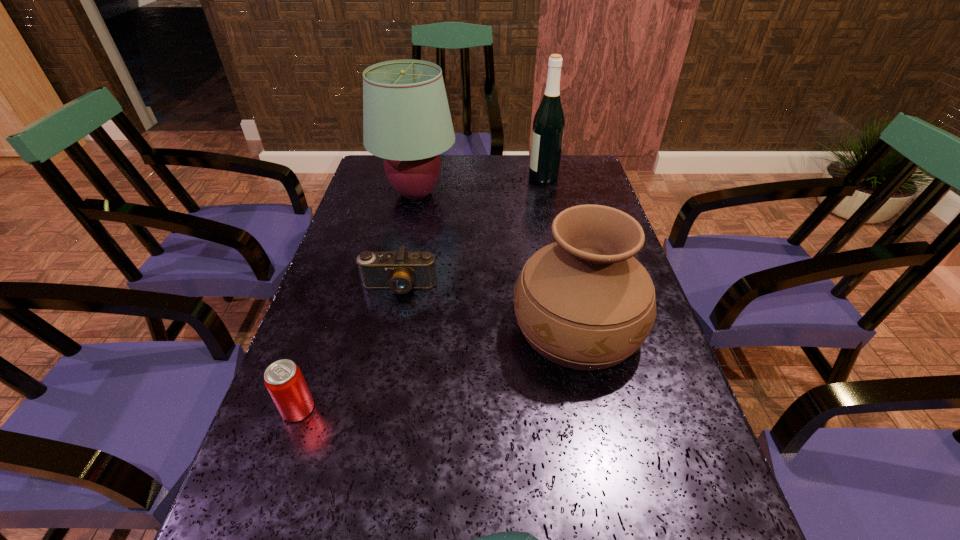
Identify the location of object at the far left corner. (406, 118).

Locate an element on the screen. object at the far right corner is located at coordinates (549, 122).

Locate an element on the screen. free space at the far edge of the desktop is located at coordinates (520, 156).

At what (x,y) coordinates should I click in order to perform the action: click on vacant region at the left edge of the desktop. Please return your answer as a coordinate pair (x, y). Looking at the image, I should click on (304, 511).

Find the location of `vacant space at the right edge of the desktop`. vacant space at the right edge of the desktop is located at coordinates (579, 192).

In order to click on vacant area between the fourth shortest object and the camera in this screenshot , I will do `click(488, 307)`.

This screenshot has width=960, height=540. In order to click on unoccupied position between the lampshade and the wine bottle in this screenshot , I will do `click(480, 185)`.

This screenshot has width=960, height=540. I want to click on vacant area that lies between the camera and the lampshade, so click(x=407, y=240).

Where is `free spot between the camera and the wine bottle`? The width and height of the screenshot is (960, 540). free spot between the camera and the wine bottle is located at coordinates (471, 232).

I want to click on free space between the lampshade and the urn, so point(496,260).